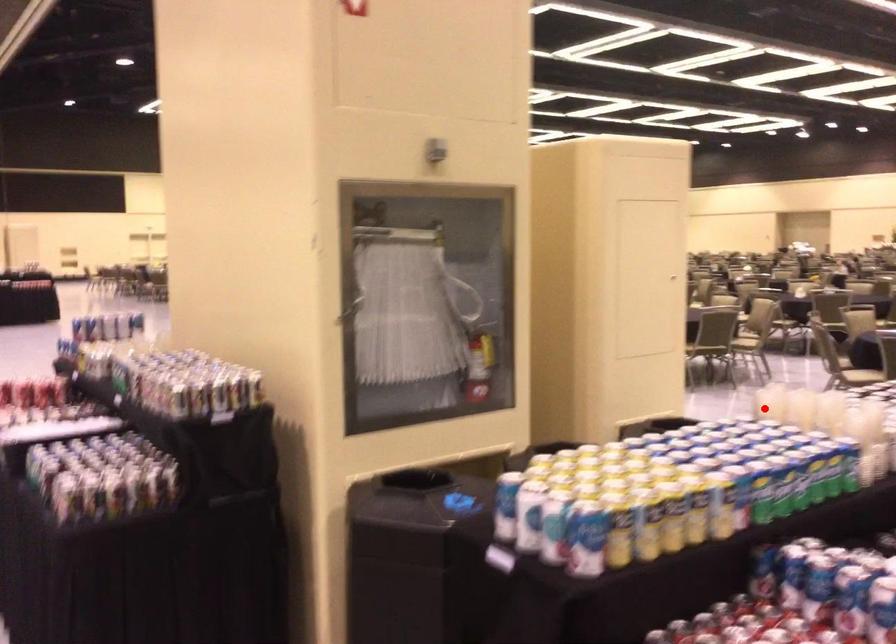
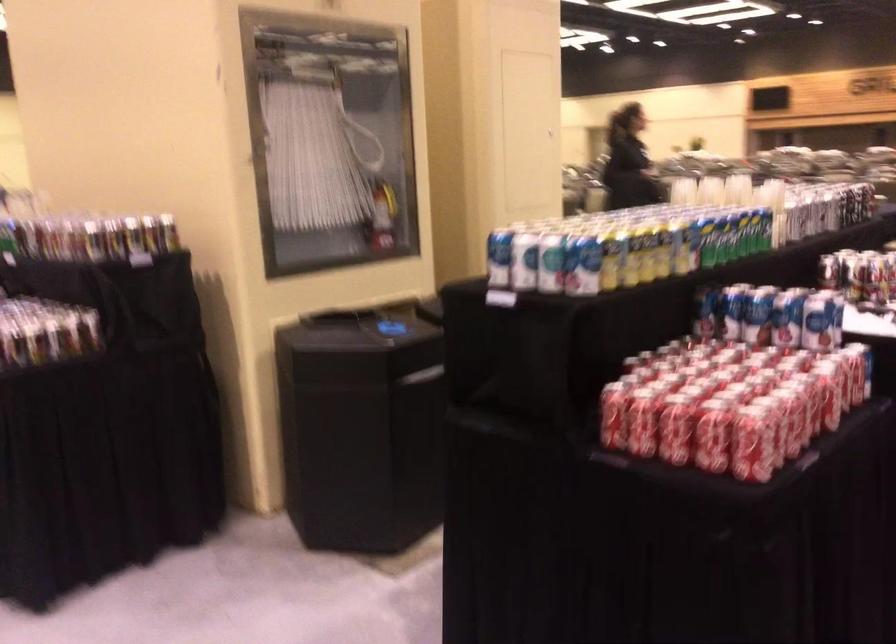
Question: A red point is marked in image1. In image2, is the corresponding 3D point closer to the camera or farther? Reply with the corresponding letter.

Choices:
 (A) The corresponding 3D point is closer.
 (B) The corresponding 3D point is farther.

Answer: (B)